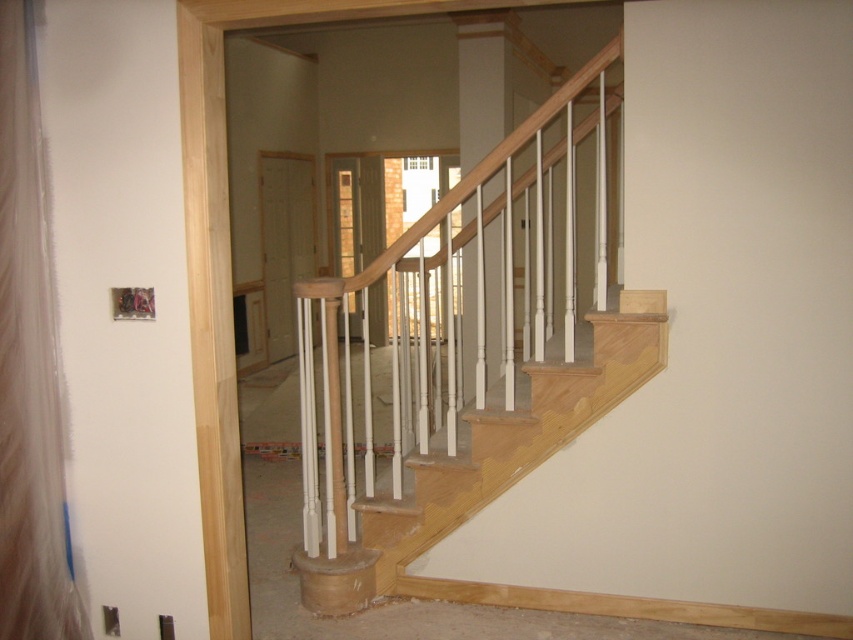
Question: Does natural wood handrail at center have a greater width compared to light wood stairwell at center?

Choices:
 (A) yes
 (B) no

Answer: (B)

Question: Can you confirm if natural wood handrail at center is positioned below light wood stairwell at center?

Choices:
 (A) no
 (B) yes

Answer: (A)

Question: Which of the following is the farthest from the observer?

Choices:
 (A) (294, 284)
 (B) (422, 529)

Answer: (B)

Question: Does natural wood handrail at center have a greater width compared to light wood stairwell at center?

Choices:
 (A) yes
 (B) no

Answer: (B)

Question: Which point is closer to the camera?

Choices:
 (A) (426, 275)
 (B) (628, 330)

Answer: (B)